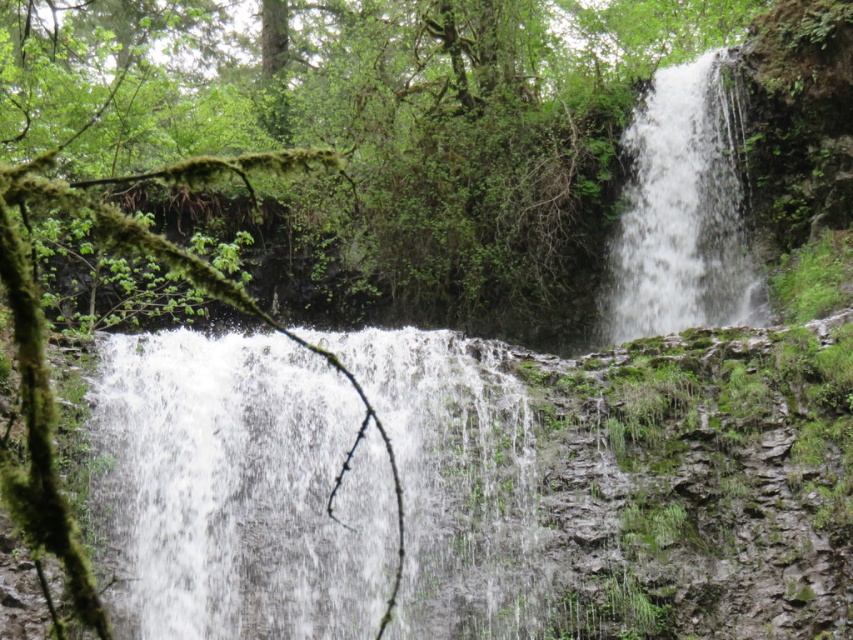
Question: Among these points, which one is farthest from the camera?

Choices:
 (A) 524,456
 (B) 735,260

Answer: (B)

Question: Is white frothy water at center positioned behind white frothy water at upper right?

Choices:
 (A) yes
 (B) no

Answer: (B)

Question: Which point is closer to the camera?

Choices:
 (A) white frothy water at center
 (B) white frothy water at upper right

Answer: (A)

Question: Which of the following is the farthest from the observer?

Choices:
 (A) white frothy water at upper right
 (B) white frothy water at center

Answer: (A)

Question: Does white frothy water at center appear under white frothy water at upper right?

Choices:
 (A) no
 (B) yes

Answer: (B)

Question: Is white frothy water at center further to the viewer compared to white frothy water at upper right?

Choices:
 (A) no
 (B) yes

Answer: (A)